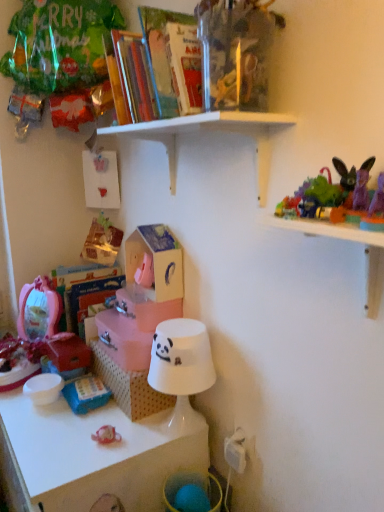
Where is `free spot in front of pink fabric toy at lower left, the 2th toy from the top`? This screenshot has height=512, width=384. free spot in front of pink fabric toy at lower left, the 2th toy from the top is located at coordinates 58,414.